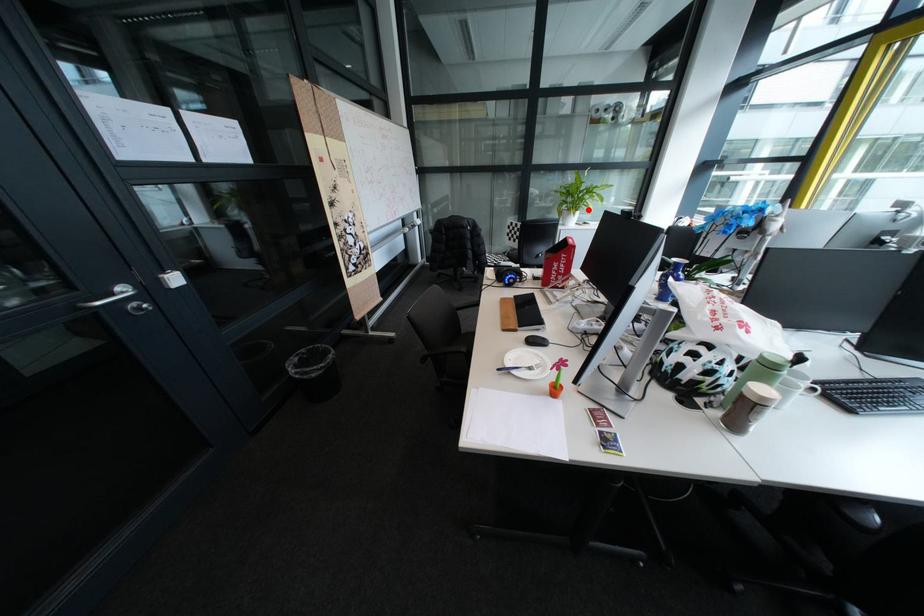
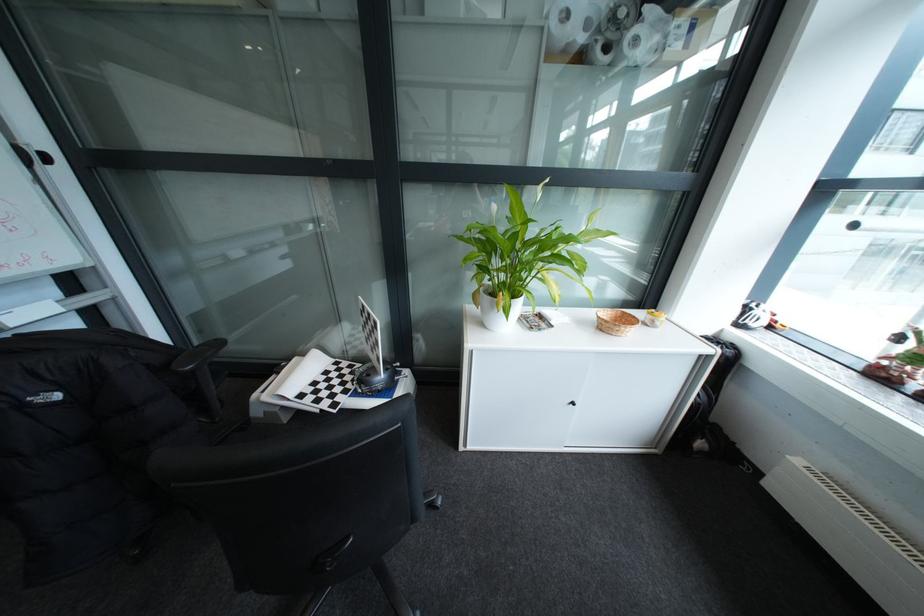
Where in the second image is the point corresponding to the highlighted location from the first image?

(521, 299)